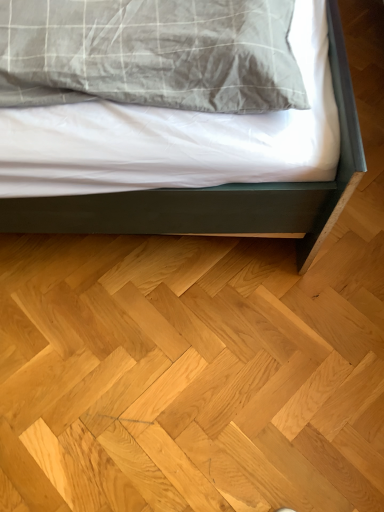
What do you see at coordinates (190, 374) in the screenshot? The width and height of the screenshot is (384, 512). I see `natural wood floor at lower center` at bounding box center [190, 374].

Locate an element on the screen. natural wood floor at lower center is located at coordinates (190, 374).

Image resolution: width=384 pixels, height=512 pixels. What do you see at coordinates (218, 192) in the screenshot? I see `matte gray bed at center` at bounding box center [218, 192].

Locate an element on the screen. Image resolution: width=384 pixels, height=512 pixels. matte gray bed at center is located at coordinates (218, 192).

Measure the distance between matte gray bed at center and camera.

The depth of matte gray bed at center is 32.88 inches.

You are a GUI agent. You are given a task and a screenshot of the screen. Output one action in this format:
    pyautogui.click(x=<x>, y=<y>)
    Task: Click on the natural wood floor at lower center
    The height and width of the screenshot is (512, 384).
    Given the screenshot: What is the action you would take?
    point(190,374)

Which is more to the right, matte gray bed at center or natural wood floor at lower center?

From the viewer's perspective, natural wood floor at lower center appears more on the right side.

Based on the photo, is matte gray bed at center further to camera compared to natural wood floor at lower center?

No, matte gray bed at center is in front of natural wood floor at lower center.

Between point (351, 132) and point (259, 450), which one is positioned behind?

Positioned behind is point (259, 450).

Based on the photo, from the image's perspective, which object appears higher, matte gray bed at center or natural wood floor at lower center?

matte gray bed at center.

From a real-world perspective, who is located lower, matte gray bed at center or natural wood floor at lower center?

natural wood floor at lower center is physically lower.

Is matte gray bed at center wider than natural wood floor at lower center?

No.

Who is taller, matte gray bed at center or natural wood floor at lower center?

matte gray bed at center is taller.

In terms of size, does matte gray bed at center appear bigger or smaller than natural wood floor at lower center?

matte gray bed at center is bigger than natural wood floor at lower center.

Would you say matte gray bed at center contains natural wood floor at lower center?

No, matte gray bed at center does not contain natural wood floor at lower center.

Is matte gray bed at center not close to natural wood floor at lower center?

matte gray bed at center is actually quite close to natural wood floor at lower center.

Is matte gray bed at center aimed at natural wood floor at lower center?

No, matte gray bed at center is not oriented towards natural wood floor at lower center.

At what (x,y) coordinates should I click in order to perform the action: click on hardwood directly beneath the matte gray bed at center (from a real-world perspective). Please return your answer as a coordinate pair (x, y). Looking at the image, I should click on (190, 374).

Considering the relative positions of natural wood floor at lower center and matte gray bed at center in the image provided, is natural wood floor at lower center to the right of matte gray bed at center from the viewer's perspective?

Indeed, natural wood floor at lower center is positioned on the right side of matte gray bed at center.

From the picture: Which object is more forward, natural wood floor at lower center or matte gray bed at center?

matte gray bed at center is in front.

Between point (90, 461) and point (114, 196), which one is positioned in front?

The point (114, 196) is closer to the camera.

From the image's perspective, relative to matte gray bed at center, is natural wood floor at lower center above or below?

natural wood floor at lower center is situated lower than matte gray bed at center in the image.

Looking at this image, from a real-world perspective, is natural wood floor at lower center above or below matte gray bed at center?

Clearly, from a real-world perspective, natural wood floor at lower center is below matte gray bed at center.

Is natural wood floor at lower center wider than matte gray bed at center?

Correct, the width of natural wood floor at lower center exceeds that of matte gray bed at center.

Between natural wood floor at lower center and matte gray bed at center, which one has less height?

With less height is natural wood floor at lower center.

Considering the relative sizes of natural wood floor at lower center and matte gray bed at center in the image provided, is natural wood floor at lower center smaller than matte gray bed at center?

Indeed, natural wood floor at lower center has a smaller size compared to matte gray bed at center.

Is natural wood floor at lower center spatially inside matte gray bed at center, or outside of it?

natural wood floor at lower center exists outside the volume of matte gray bed at center.

Is natural wood floor at lower center not near matte gray bed at center?

No, natural wood floor at lower center is not far from matte gray bed at center.

Is natural wood floor at lower center facing towards matte gray bed at center?

No, natural wood floor at lower center is not oriented towards matte gray bed at center.

In order to click on bed lying on the left of natural wood floor at lower center in this screenshot , I will do `click(218, 192)`.

In the image, there is a matte gray bed at center. Identify the location of hardwood below it (from the image's perspective). (190, 374).

Find the location of a particular element. hardwood located underneath the matte gray bed at center (from a real-world perspective) is located at coordinates (190, 374).